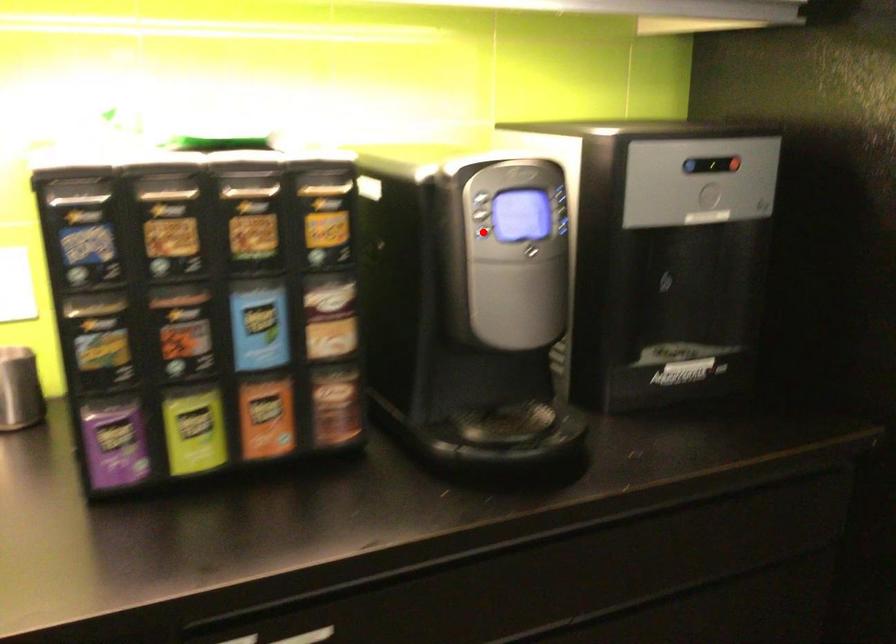
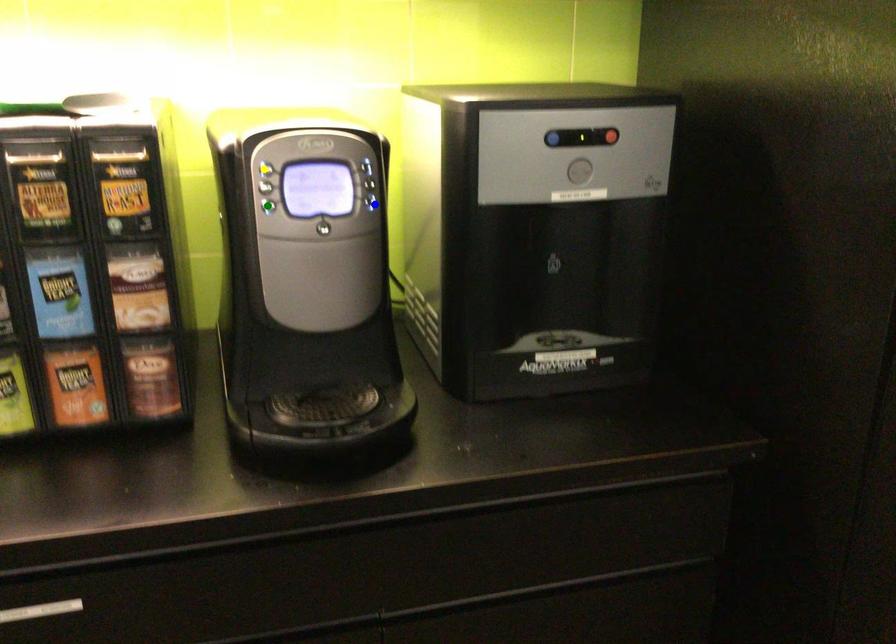
Question: I am providing you with two images of the same scene from different viewpoints. A red point is marked on the first image. You are given multiple points on the second image. In image 2, which mark is for the same physical point as the one in image 1?

Choices:
 (A) yellow point
 (B) green point
 (C) blue point

Answer: (B)